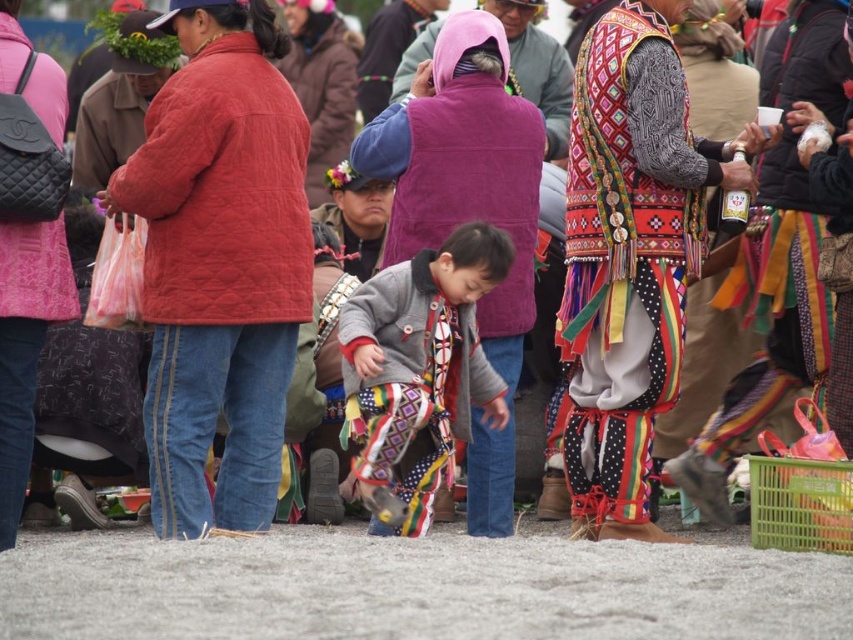
Looking at this image, you are a photographer standing at the edge of the gathering. You need to capture a photo that includes both the embroidered fabric dress at center and the patterned fabric pants at center. Given that your camera has a maximum zoom range that can cover 10 meters, can you fit both items into the frame without moving closer?

The distance between the embroidered fabric dress at center and the patterned fabric pants at center is 9.44 meters, which is within the camera maximum zoom range of 10 meters. Therefore, the photographer can fit both items into the frame without moving closer.

You are at an outdoor event and need to locate two people wearing a quilted red jacket at center and a purple fleece vest at center. Which one is positioned lower in the image?

The quilted red jacket at center is located below the purple fleece vest at center, so the quilted red jacket at center is positioned lower in the image.

You are a photographer at the event and need to capture a clear shot of both the embroidered fabric dress at center and the patterned fabric pants at center. Which one is closer to the camera?

The embroidered fabric dress at center is closer to the camera because it is in front of the patterned fabric pants at center.